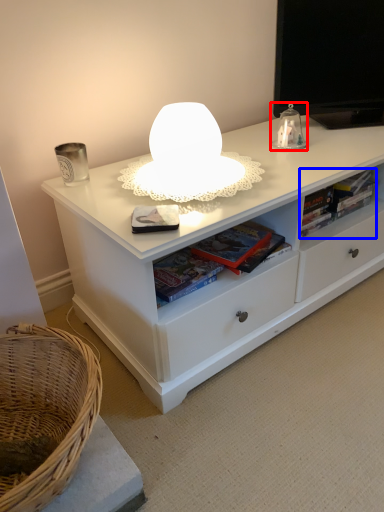
Question: Which object appears farthest to the camera in this image, table lamp (highlighted by a red box) or book (highlighted by a blue box)?

Choices:
 (A) table lamp
 (B) book

Answer: (B)